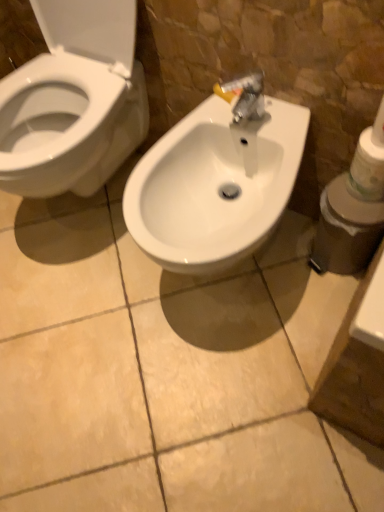
This screenshot has width=384, height=512. Identify the location of free location to the left of white glossy sink at center. (91, 323).